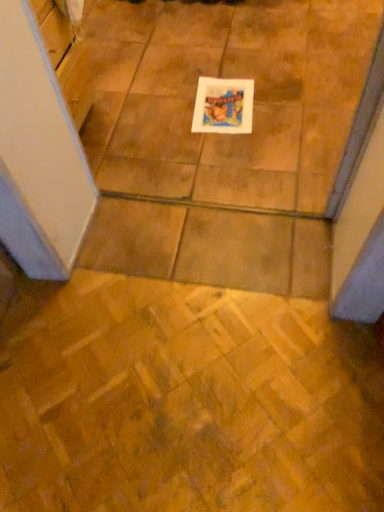
Locate an element on the screen. free location above white paper at center (from a real-world perspective) is located at coordinates (226, 104).